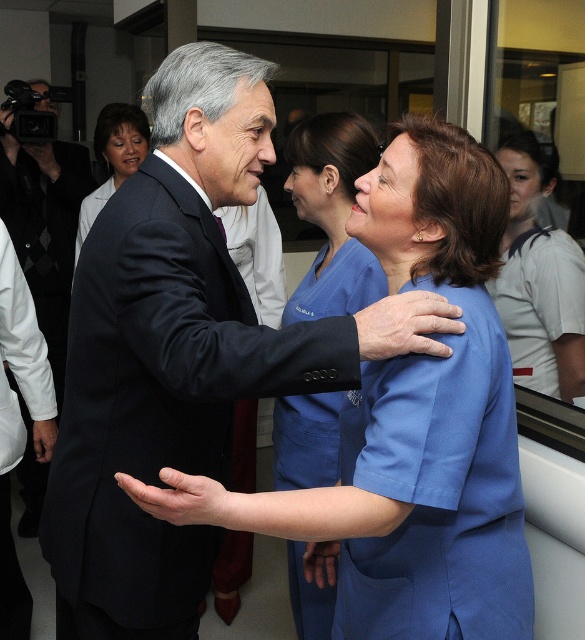
Is dark suit at left to the right of leather-like hand at center from the viewer's perspective?

In fact, dark suit at left is to the left of leather-like hand at center.

Who is higher up, dark suit at left or leather-like hand at center?

dark suit at left is higher up.

Who is more distant from viewer, (x=90, y=170) or (x=359, y=314)?

Positioned behind is point (x=90, y=170).

Locate an element on the screen. This screenshot has width=585, height=640. dark suit at left is located at coordinates (46, 228).

Measure the distance between smooth skin hand at center and black leather hand at center.

smooth skin hand at center is 94.54 centimeters away from black leather hand at center.

Can you confirm if smooth skin hand at center is positioned to the left of black leather hand at center?

In fact, smooth skin hand at center is to the right of black leather hand at center.

Where is `smooth skin hand at center`? The height and width of the screenshot is (640, 585). smooth skin hand at center is located at coordinates (321, 561).

Is black wool suit at center shorter than blue scrubs at center?

Correct, black wool suit at center is not as tall as blue scrubs at center.

Is the position of black wool suit at center less distant than that of blue scrubs at center?

Yes, it is in front of blue scrubs at center.

The height and width of the screenshot is (640, 585). Find the location of `black wool suit at center`. black wool suit at center is located at coordinates (161, 396).